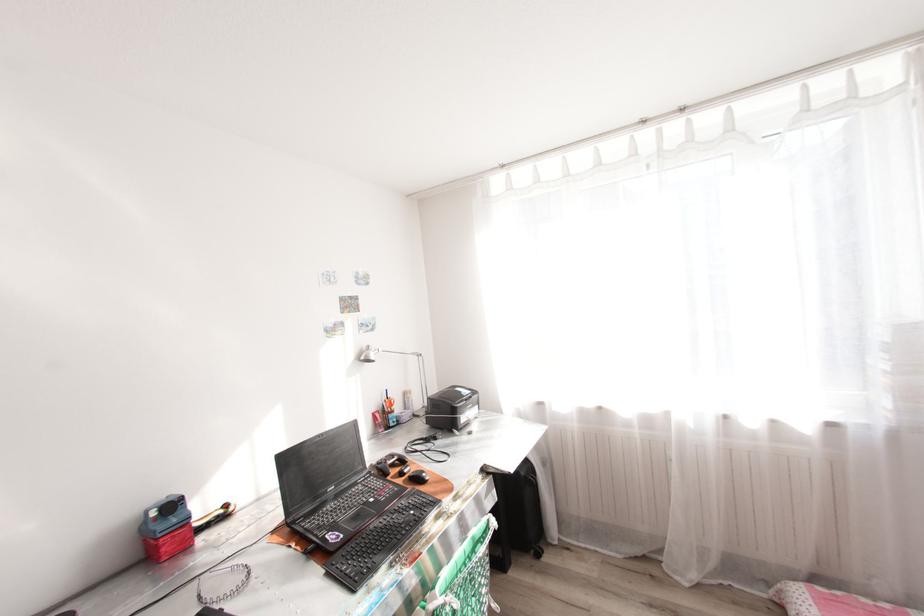
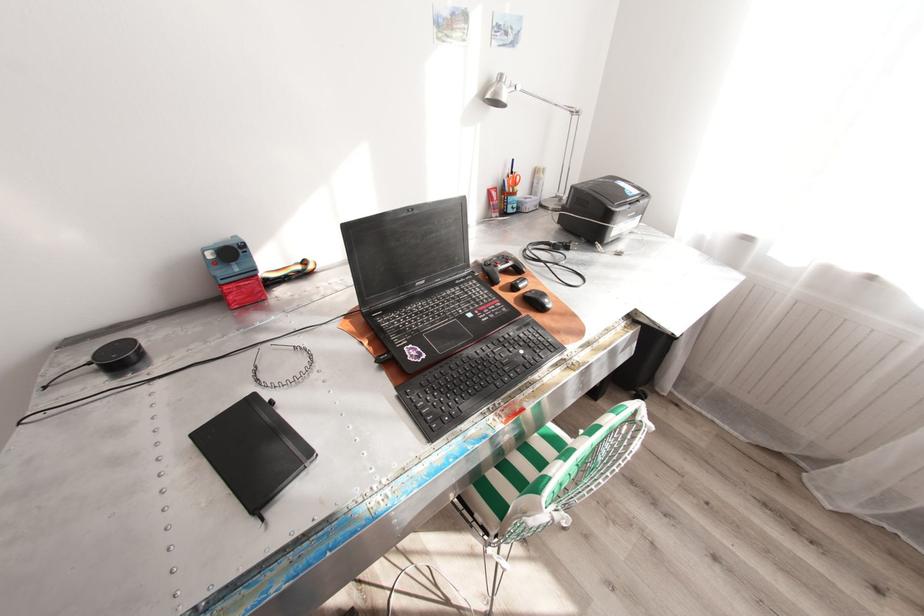
Where in the second image is the point corresponding to (193,523) from the first image?

(261, 275)